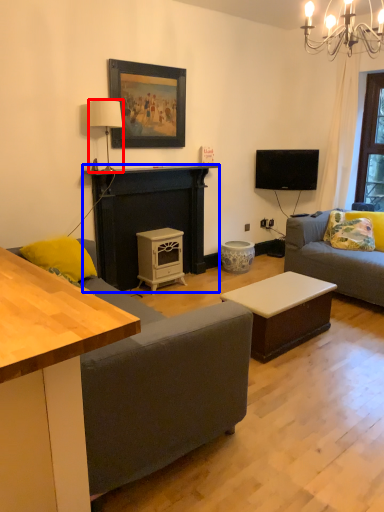
Question: Which object appears farthest to the camera in this image, lamp (highlighted by a red box) or fireplace (highlighted by a blue box)?

Choices:
 (A) lamp
 (B) fireplace

Answer: (B)